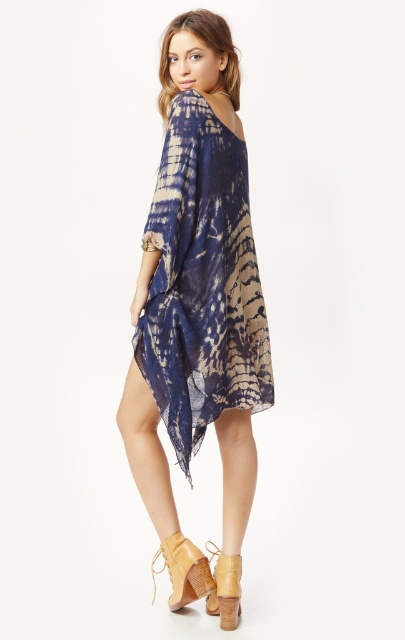
Question: Which object is closer to the camera taking this photo?

Choices:
 (A) matte tan leather sandal at lower center
 (B) tan suede boot at lower center

Answer: (B)

Question: Is tie-dye chiffon dress at center wider than matte tan leather sandal at lower center?

Choices:
 (A) no
 (B) yes

Answer: (B)

Question: Which point is farther from the camera taking this photo?

Choices:
 (A) (164, 547)
 (B) (151, 372)
 (C) (215, 572)

Answer: (C)

Question: Can you confirm if tan suede boot at lower center is bigger than matte tan leather sandal at lower center?

Choices:
 (A) no
 (B) yes

Answer: (B)

Question: Is tie-dye chiffon dress at center to the right of tan suede boot at lower center from the viewer's perspective?

Choices:
 (A) no
 (B) yes

Answer: (B)

Question: Based on their relative distances, which object is farther from the tan suede boot at lower center?

Choices:
 (A) matte tan leather sandal at lower center
 (B) tie-dye chiffon dress at center

Answer: (B)